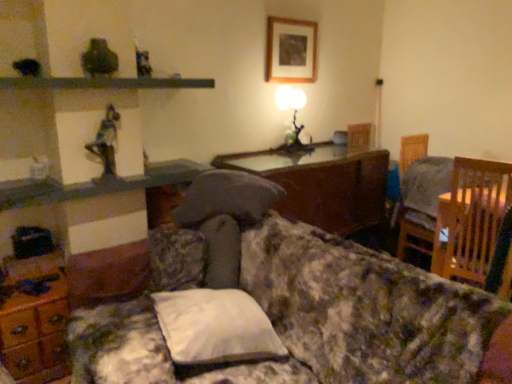
Where is `matte glass table lamp at center`? Image resolution: width=512 pixels, height=384 pixels. matte glass table lamp at center is located at coordinates (293, 114).

Describe the element at coordinates (291, 50) in the screenshot. I see `wooden picture frame at upper center` at that location.

This screenshot has width=512, height=384. What do you see at coordinates (104, 83) in the screenshot?
I see `metallic gray shelf at upper center` at bounding box center [104, 83].

You are a GUI agent. You are given a task and a screenshot of the screen. Output one action in this format:
    pyautogui.click(x=<x>, y=<y>)
    Task: Click on the metallic gray shelf at upper center
    This screenshot has height=384, width=512.
    Given the screenshot: What is the action you would take?
    pyautogui.click(x=104, y=83)

Locate an element on the screen. The width and height of the screenshot is (512, 384). wooden chair at right is located at coordinates (471, 218).

In order to face wooden chair at right, should I rotate leftwards or rightwards?

Rotate your view right by about 28.009°.

Measure the distance between point (298, 189) and camera.

Point (298, 189) and camera are 2.81 meters apart.

Image resolution: width=512 pixels, height=384 pixels. I want to click on floral fabric couch at center, so click(x=324, y=291).

Could white fabric pillow at center be considered to be inside matte glass table lamp at center?

No.

Based on the photo, from the image's perspective, between matte glass table lamp at center and white fabric pillow at center, who is located below?

white fabric pillow at center appears lower in the image.

Which object is thinner, matte glass table lamp at center or white fabric pillow at center?

Thinner between the two is matte glass table lamp at center.

The width and height of the screenshot is (512, 384). In order to click on pillow lying below the matte glass table lamp at center (from the image's perspective) in this screenshot , I will do click(215, 327).

In the scene shown: How different are the orientations of wooden dresser at lower left and wooden chair at right in degrees?

They differ by 90.1 degrees in their facing directions.

Is wooden dresser at lower left to the left or to the right of wooden chair at right in the image?

Clearly, wooden dresser at lower left is on the left of wooden chair at right in the image.

Between point (34, 377) and point (477, 184), which one is positioned in front?

The point (34, 377) is in front.

Is wooden dresser at lower left oriented towards wooden chair at right?

No, wooden dresser at lower left is not aimed at wooden chair at right.

Is point (220, 315) more distant than point (313, 302)?

Yes, point (220, 315) is behind point (313, 302).

In the image, is white fabric pillow at center on the left side or the right side of floral fabric couch at center?

From the image, it's evident that white fabric pillow at center is to the left of floral fabric couch at center.

Considering the relative sizes of white fabric pillow at center and floral fabric couch at center in the image provided, is white fabric pillow at center taller than floral fabric couch at center?

No.

Does metallic gray shelf at upper center have a larger size compared to wooden glossy table at center?

No, metallic gray shelf at upper center is not bigger than wooden glossy table at center.

Is point (35, 79) less distant than point (331, 210)?

Yes, point (35, 79) is in front of point (331, 210).

How different are the orientations of metallic gray shelf at upper center and wooden glossy table at center in degrees?

1.64 degrees.

Are metallic gray shelf at upper center and wooden glossy table at center far apart?

Yes, metallic gray shelf at upper center and wooden glossy table at center are quite far apart.

Is wooden glossy table at center bigger than matte glass table lamp at center?

Yes, wooden glossy table at center is bigger than matte glass table lamp at center.

Is point (311, 175) closer to camera compared to point (294, 129)?

Yes, point (311, 175) is in front of point (294, 129).

In the scene shown: How distant is wooden glossy table at center from matte glass table lamp at center?

wooden glossy table at center and matte glass table lamp at center are 20.29 inches apart from each other.

From a real-world perspective, which object rests below the other?

wooden glossy table at center is physically lower.

Is white fabric pillow at center shorter than wooden picture frame at upper center?

Indeed, white fabric pillow at center has a lesser height compared to wooden picture frame at upper center.

In order to click on pillow on the left of wooden picture frame at upper center in this screenshot , I will do `click(215, 327)`.

Considering the positions of objects white fabric pillow at center and wooden picture frame at upper center in the image provided, who is behind, white fabric pillow at center or wooden picture frame at upper center?

Positioned behind is wooden picture frame at upper center.

Does white fabric pillow at center have a larger size compared to wooden picture frame at upper center?

Yes.

Is metallic statue at upper left oriented away from floral fabric couch at center?

No, metallic statue at upper left's orientation is not away from floral fabric couch at center.

Does metallic statue at upper left contain floral fabric couch at center?

No.

Considering the relative sizes of metallic statue at upper left and floral fabric couch at center in the image provided, is metallic statue at upper left shorter than floral fabric couch at center?

Yes.

Can you tell me how much metallic statue at upper left and floral fabric couch at center differ in facing direction?

The facing directions of metallic statue at upper left and floral fabric couch at center are 92 degrees apart.

This screenshot has width=512, height=384. What are the coordinates of `pillow located on the left of matte glass table lamp at center` in the screenshot? It's located at (215, 327).

At what (x,y) coordinates should I click in order to perform the action: click on chair that appears behind the wooden dresser at lower left. Please return your answer as a coordinate pair (x, y). Image resolution: width=512 pixels, height=384 pixels. Looking at the image, I should click on (471, 218).

Looking at the image, which one is located further to metallic gray shelf at upper center, white fabric pillow at center or wooden chair at right?

wooden chair at right is positioned further to the anchor metallic gray shelf at upper center.

Estimate the real-world distances between objects in this image. Which object is further from wooden dresser at lower left, wooden glossy table at center or wooden picture frame at upper center?

Among the two, wooden picture frame at upper center is located further to wooden dresser at lower left.

Consider the image. Considering their positions, is metallic gray shelf at upper center positioned further to wooden dresser at lower left than white fabric pillow at center?

metallic gray shelf at upper center is further to wooden dresser at lower left.

Considering their positions, is metallic statue at upper left positioned further to metallic gray shelf at upper center than wooden glossy table at center?

wooden glossy table at center lies further to metallic gray shelf at upper center than the other object.

From the image, which object appears to be nearer to metallic gray shelf at upper center, matte glass table lamp at center or metallic statue at upper left?

metallic statue at upper left.

From the image, which object appears to be farther from matte glass table lamp at center, metallic gray shelf at upper center or wooden picture frame at upper center?

metallic gray shelf at upper center lies further to matte glass table lamp at center than the other object.

From the image, which object appears to be nearer to floral fabric couch at center, wooden picture frame at upper center or wooden dresser at lower left?

wooden dresser at lower left is closer to floral fabric couch at center.

From the image, which object appears to be nearer to floral fabric couch at center, wooden chair at right or wooden dresser at lower left?

wooden dresser at lower left.

Locate an element on the screen. table lamp between wooden picture frame at upper center and wooden chair at right vertically is located at coordinates (293, 114).

I want to click on table between metallic statue at upper left and wooden chair at right, so click(x=322, y=183).

You are a GUI agent. You are given a task and a screenshot of the screen. Output one action in this format:
    pyautogui.click(x=<x>, y=<y>)
    Task: Click on the picture frame between wooden dresser at lower left and wooden chair at right
    
    Given the screenshot: What is the action you would take?
    pyautogui.click(x=291, y=50)

Find the location of a particular element. table between matte glass table lamp at center and wooden chair at right from left to right is located at coordinates (322, 183).